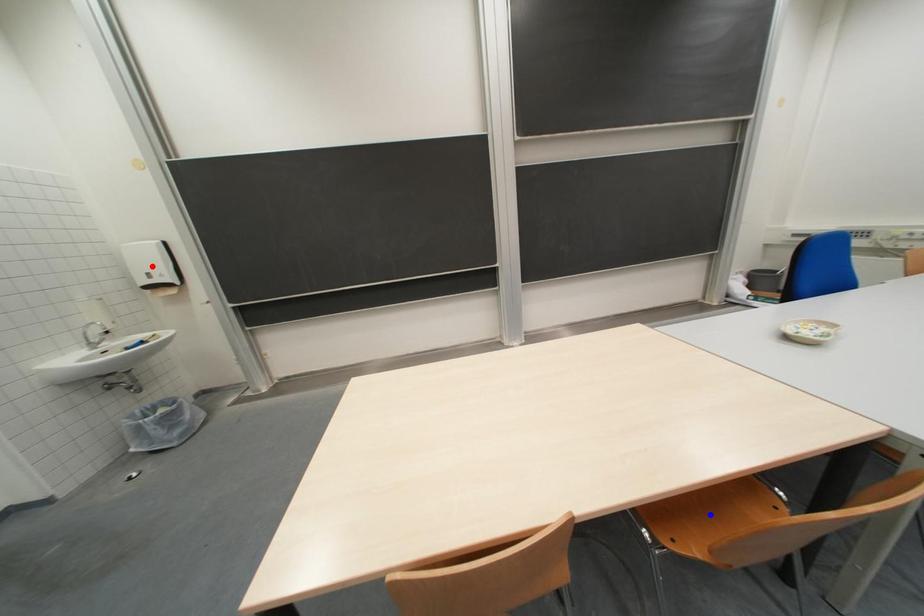
Question: Which of the two points in the image is closer to the camera?

Choices:
 (A) Blue point is closer.
 (B) Red point is closer.

Answer: (A)